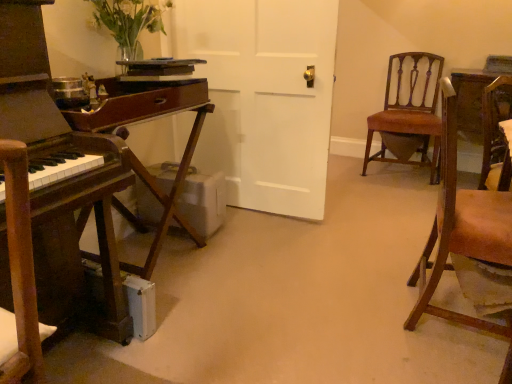
This screenshot has width=512, height=384. Identify the location of vacant space behind brown leather chair at right, arranged as the second chair when viewed from the back. (382, 260).